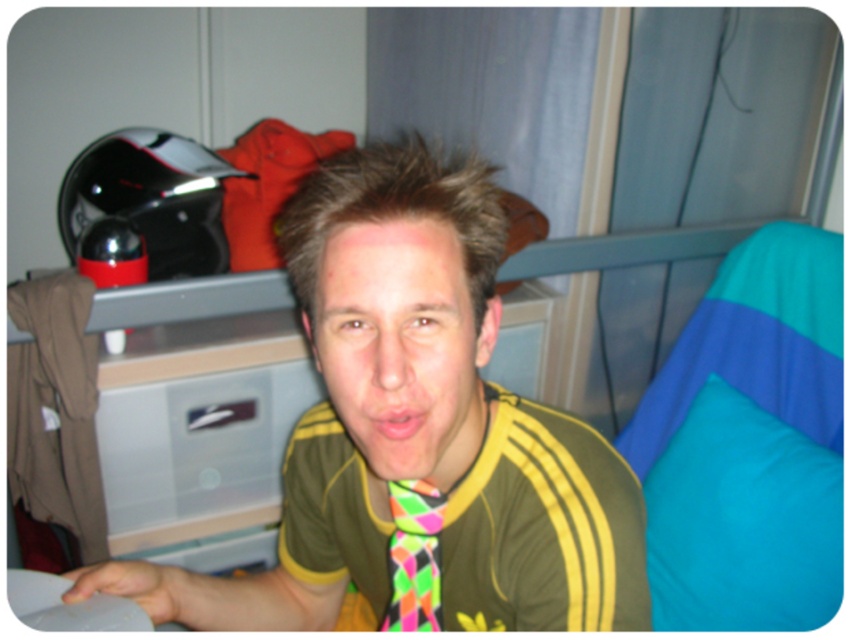
Question: Is clear plastic drawer at center wider than neon multicolored fabric tie at center?

Choices:
 (A) yes
 (B) no

Answer: (A)

Question: Is neon tie at center to the right of pink neon tie at center from the viewer's perspective?

Choices:
 (A) yes
 (B) no

Answer: (B)

Question: Which of these objects is positioned closest to the neon tie at center?

Choices:
 (A) clear plastic drawer at center
 (B) pink neon tie at center

Answer: (B)

Question: Estimate the real-world distances between objects in this image. Which object is closer to the clear plastic drawer at center?

Choices:
 (A) pink neon tie at center
 (B) neon multicolored fabric tie at center

Answer: (B)

Question: Among these points, which one is nearest to the camera?

Choices:
 (A) [376, 436]
 (B) [199, 481]
 (C) [419, 520]

Answer: (A)

Question: Is neon multicolored fabric tie at center smaller than pink neon tie at center?

Choices:
 (A) no
 (B) yes

Answer: (A)